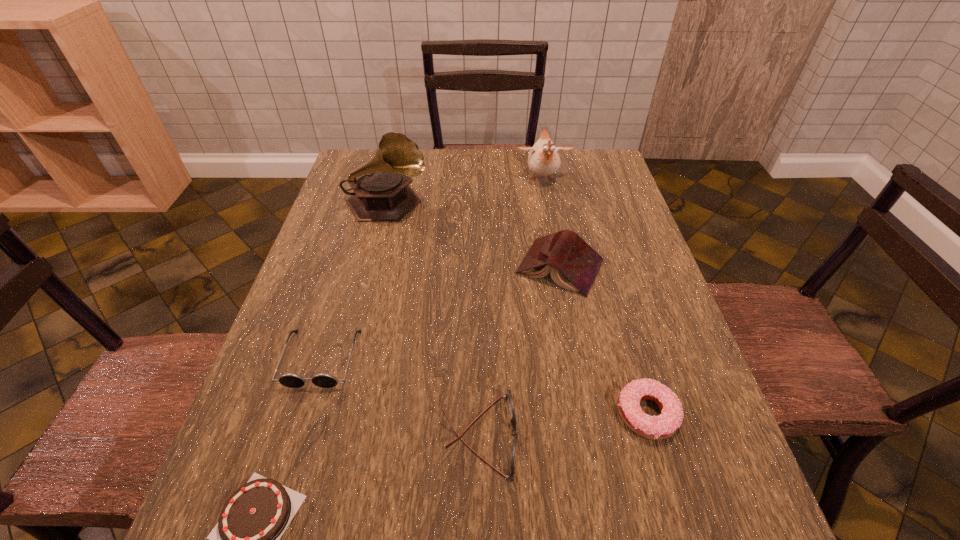
Identify the location of free space located on the front-facing side of the sunglasses. 270,528.

You are a GUI agent. You are given a task and a screenshot of the screen. Output one action in this format:
    pyautogui.click(x=<x>, y=<y>)
    Task: Click on the vacant space located 0.340m on the front-facing side of the spectacles
    The width and height of the screenshot is (960, 540).
    Given the screenshot: What is the action you would take?
    pyautogui.click(x=702, y=435)

The width and height of the screenshot is (960, 540). I want to click on vacant area situated on the front of the doughnut, so click(678, 523).

Find the location of a particular element. The width and height of the screenshot is (960, 540). phonograph record positioned at the far edge is located at coordinates (382, 193).

At what (x,y) coordinates should I click in order to perform the action: click on bird that is at the far edge. Please return your answer as a coordinate pair (x, y). The image size is (960, 540). Looking at the image, I should click on (543, 160).

At what (x,y) coordinates should I click in order to perform the action: click on phonograph record that is at the left edge. Please return your answer as a coordinate pair (x, y). This screenshot has height=540, width=960. Looking at the image, I should click on (382, 193).

Image resolution: width=960 pixels, height=540 pixels. Identify the location of sunglasses at the left edge. (291, 380).

You are a GUI agent. You are given a task and a screenshot of the screen. Output one action in this format:
    pyautogui.click(x=<x>, y=<y>)
    Task: Click on the bird that is at the right edge
    Image resolution: width=960 pixels, height=540 pixels.
    Given the screenshot: What is the action you would take?
    pyautogui.click(x=543, y=160)

Identify the location of book that is at the right edge. This screenshot has width=960, height=540. (574, 265).

I want to click on doughnut present at the right edge, so click(663, 426).